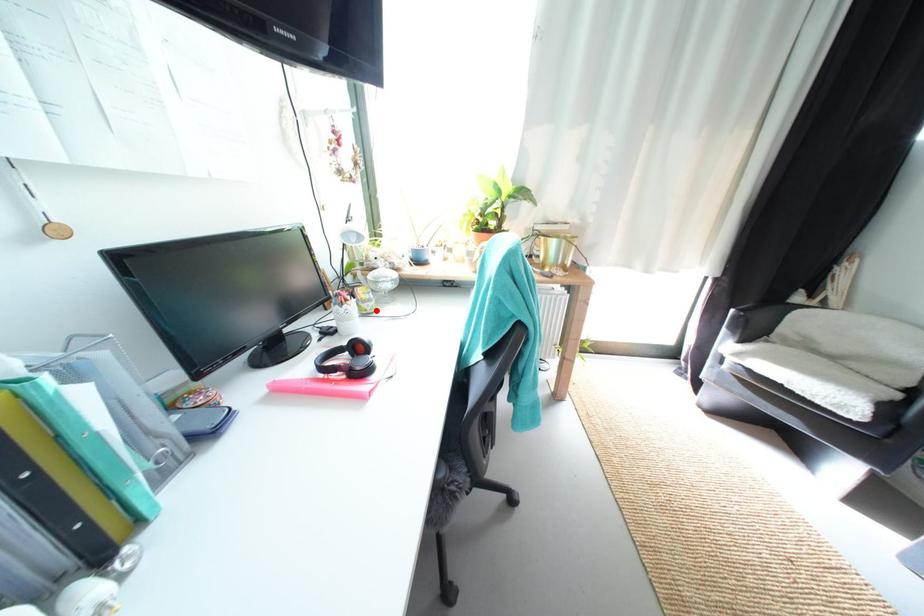
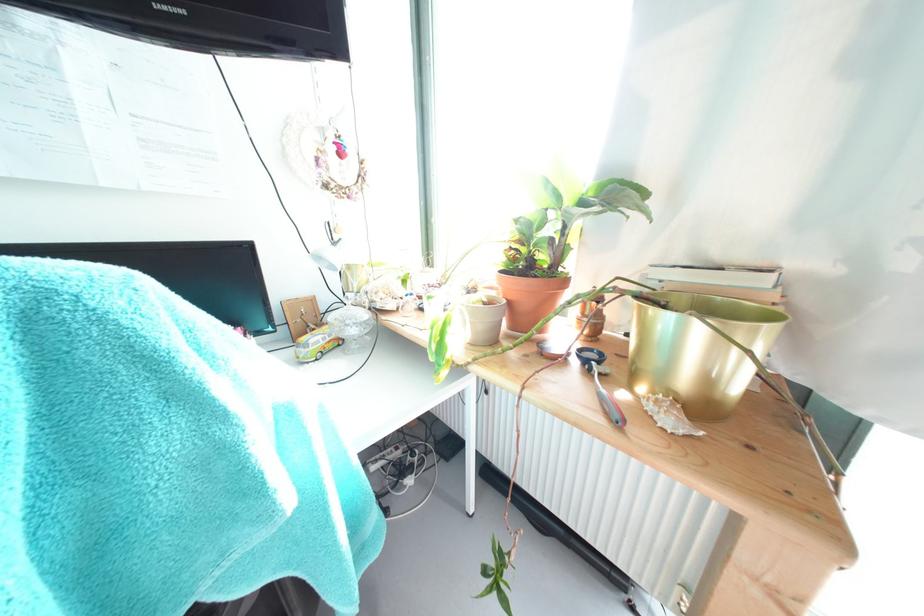
Where in the second image is the point corresponding to the highlighted location from the first image?

(309, 358)